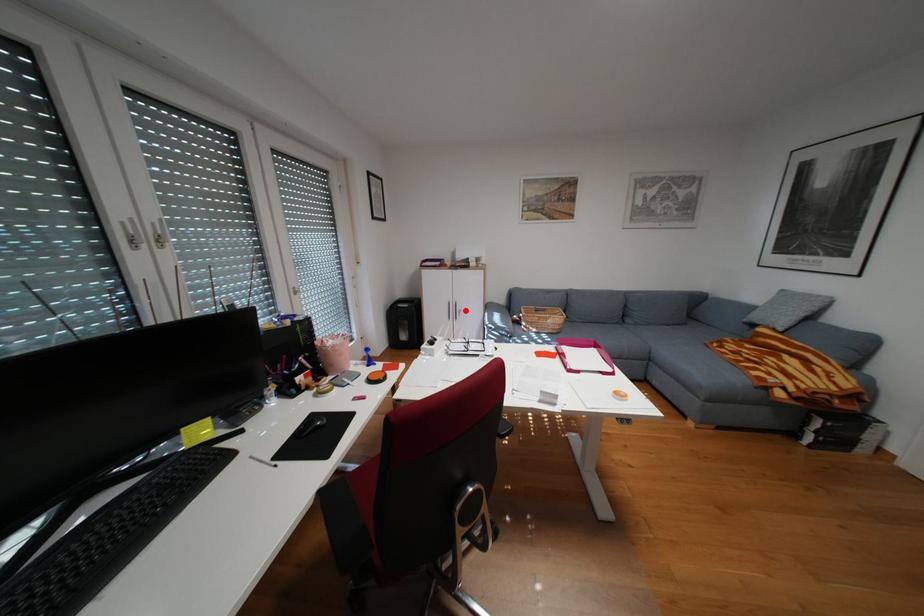
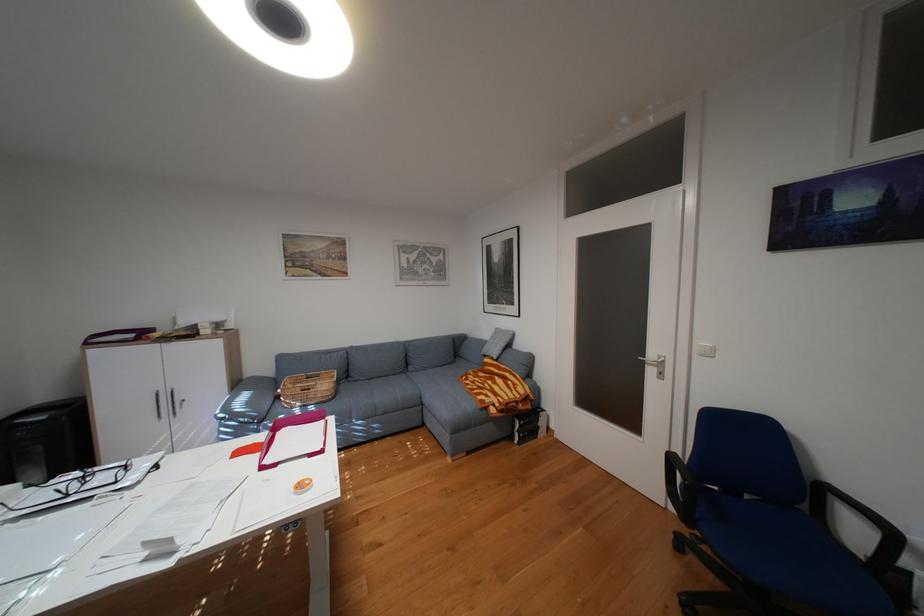
Question: I am providing you with two images of the same scene from different viewpoints. A red point is marked on the first image. At the location where the point appears in image 1, is it still visible in image 2?

Choices:
 (A) Yes
 (B) No

Answer: (A)